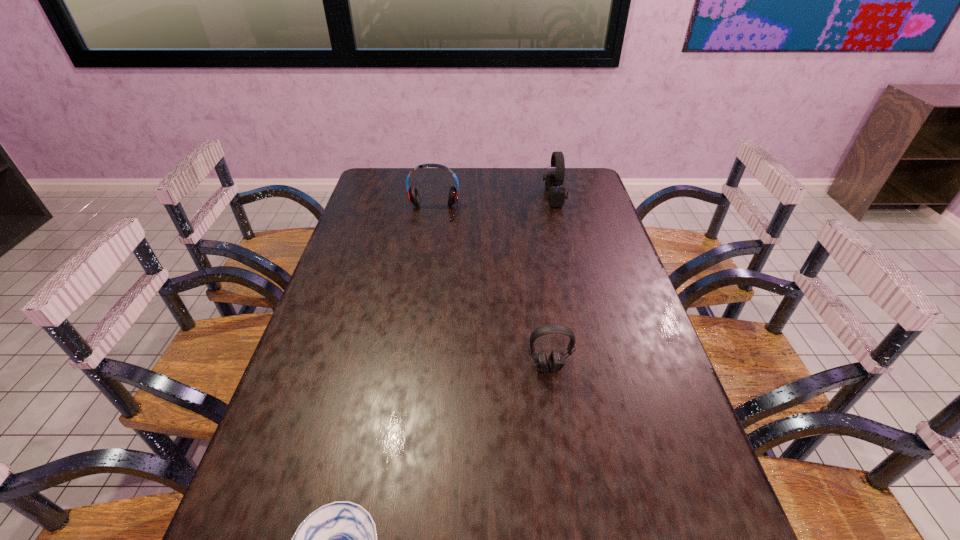
Find the location of a particular element. Image resolution: width=960 pixels, height=540 pixels. vacant space in between the rightmost object and the second nearest object is located at coordinates (551, 282).

Locate an element on the screen. The height and width of the screenshot is (540, 960). free space between the second object from right to left and the leftmost headset is located at coordinates (491, 289).

Point out which object is positioned as the nearest to the soup bowl. Please provide its 2D coordinates. Your answer should be formatted as a tuple, i.e. [(x, y)], where the tuple contains the x and y coordinates of a point satisfying the conditions above.

[(556, 363)]

Identify which object is the third nearest to the third farthest object. Please provide its 2D coordinates. Your answer should be formatted as a tuple, i.e. [(x, y)], where the tuple contains the x and y coordinates of a point satisfying the conditions above.

[(556, 195)]

The height and width of the screenshot is (540, 960). What are the coordinates of `headset that is the closest to the rightmost headset` in the screenshot? It's located at (413, 195).

Choose which headset is the third nearest neighbor to the soup bowl. Please provide its 2D coordinates. Your answer should be formatted as a tuple, i.e. [(x, y)], where the tuple contains the x and y coordinates of a point satisfying the conditions above.

[(556, 195)]

Locate an element on the screen. The image size is (960, 540). vacant region that satisfies the following two spatial constraints: 1. on the headband of the rightmost headset; 2. on the front-facing side of the second nearest object is located at coordinates (595, 368).

Find the location of a particular element. Image resolution: width=960 pixels, height=540 pixels. free space in the image that satisfies the following two spatial constraints: 1. on the headband of the rightmost object; 2. with the microphone attached to the side of the leftmost headset is located at coordinates (557, 211).

Find the location of a particular element. vacant space that satisfies the following two spatial constraints: 1. on the headband of the rightmost object; 2. on the front-facing side of the second headset from right to left is located at coordinates (595, 368).

What are the coordinates of `free space that satisfies the following two spatial constraints: 1. on the headband of the rightmost object; 2. on the front-facing side of the second headset from right to left` in the screenshot? It's located at (595, 368).